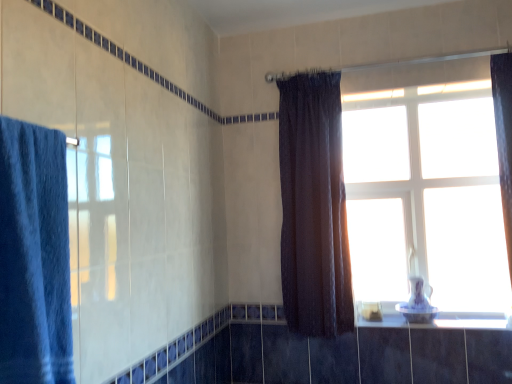
The width and height of the screenshot is (512, 384). What do you see at coordinates (313, 206) in the screenshot? I see `dark brown sheer curtain at center, the second curtain viewed from the front` at bounding box center [313, 206].

Find the location of a particular element. The height and width of the screenshot is (384, 512). dark brown sheer curtain at center, acting as the 1th curtain starting from the right is located at coordinates (313, 206).

I want to click on white glossy window sill at lower right, so click(x=441, y=320).

The height and width of the screenshot is (384, 512). I want to click on white glass window at upper right, so click(432, 191).

Can you confirm if white glossy window sill at lower right is smaller than white glass window at upper right?

Yes, white glossy window sill at lower right is smaller than white glass window at upper right.

Which of these two, white glossy window sill at lower right or white glass window at upper right, is wider?

white glossy window sill at lower right.

Is white glossy window sill at lower right with white glass window at upper right?

No, white glossy window sill at lower right is not beside white glass window at upper right.

From the image's perspective, is white glossy window sill at lower right positioned above or below white glass window at upper right?

white glossy window sill at lower right is below white glass window at upper right.

This screenshot has width=512, height=384. What are the coordinates of `curtain on the right of blue fabric towel at left, which is the 1th curtain from front to back` in the screenshot? It's located at (313, 206).

Considering the relative positions of dark brown sheer curtain at center, the second curtain viewed from the front, and blue fabric towel at left, which is the second curtain in right-to-left order, in the image provided, is dark brown sheer curtain at center, the second curtain viewed from the front, to the left of blue fabric towel at left, which is the second curtain in right-to-left order, from the viewer's perspective?

No, dark brown sheer curtain at center, the second curtain viewed from the front, is not to the left of blue fabric towel at left, which is the second curtain in right-to-left order.

Considering the sizes of objects dark brown sheer curtain at center, acting as the 1th curtain starting from the right, and blue fabric towel at left, which is the second curtain in right-to-left order, in the image provided, who is shorter, dark brown sheer curtain at center, acting as the 1th curtain starting from the right, or blue fabric towel at left, which is the second curtain in right-to-left order,?

With less height is blue fabric towel at left, which is the second curtain in right-to-left order.

Is point (391, 91) positioned in front of point (312, 231)?

No, (391, 91) is further to viewer.

Based on the photo, is white glass window at upper right oriented away from dark brown sheer curtain at center, the 2th curtain positioned from the left?

No, white glass window at upper right is not facing the opposite direction of dark brown sheer curtain at center, the 2th curtain positioned from the left.

Is white glass window at upper right bigger or smaller than dark brown sheer curtain at center, the second curtain viewed from the front?

white glass window at upper right is smaller than dark brown sheer curtain at center, the second curtain viewed from the front.

Would you say dark brown sheer curtain at center, the 2th curtain positioned from the left, is part of white glass window at upper right's contents?

Definitely not — dark brown sheer curtain at center, the 2th curtain positioned from the left, is not inside white glass window at upper right.

Can you confirm if blue fabric towel at left, which is the 1th curtain from front to back, is smaller than dark brown sheer curtain at center, the second curtain viewed from the front?

Indeed, blue fabric towel at left, which is the 1th curtain from front to back, has a smaller size compared to dark brown sheer curtain at center, the second curtain viewed from the front.

From the image's perspective, is blue fabric towel at left, which is the 1th curtain from front to back, above or below dark brown sheer curtain at center, the second curtain viewed from the front?

Clearly, from the image's perspective, blue fabric towel at left, which is the 1th curtain from front to back, is below dark brown sheer curtain at center, the second curtain viewed from the front.

From a real-world perspective, who is located lower, blue fabric towel at left, which is the 1th curtain from front to back, or dark brown sheer curtain at center, the second curtain viewed from the front?

blue fabric towel at left, which is the 1th curtain from front to back, from a real-world perspective.

Where is `window sill below the dark brown sheer curtain at center, the 2th curtain positioned from the left (from the image's perspective)`? The image size is (512, 384). window sill below the dark brown sheer curtain at center, the 2th curtain positioned from the left (from the image's perspective) is located at coordinates (441, 320).

Is dark brown sheer curtain at center, which is the 1th curtain from back to front, wider or thinner than white glossy window sill at lower right?

Clearly, dark brown sheer curtain at center, which is the 1th curtain from back to front, has less width compared to white glossy window sill at lower right.

Which is more to the right, dark brown sheer curtain at center, the 2th curtain positioned from the left, or white glossy window sill at lower right?

From the viewer's perspective, white glossy window sill at lower right appears more on the right side.

Does point (440, 313) come in front of point (314, 117)?

That is True.

From the picture: Is dark brown sheer curtain at center, the 2th curtain positioned from the left, inside white glossy window sill at lower right?

No, white glossy window sill at lower right does not contain dark brown sheer curtain at center, the 2th curtain positioned from the left.

Are white glossy window sill at lower right and dark brown sheer curtain at center, which is the 1th curtain from back to front, beside each other?

No.

Between white glossy window sill at lower right and dark brown sheer curtain at center, the second curtain viewed from the front, which one appears on the left side from the viewer's perspective?

dark brown sheer curtain at center, the second curtain viewed from the front, is more to the left.

Is white glass window at upper right inside dark brown sheer curtain at center, the second curtain viewed from the front?

No.

Considering the sizes of dark brown sheer curtain at center, the 2th curtain positioned from the left, and white glass window at upper right in the image, is dark brown sheer curtain at center, the 2th curtain positioned from the left, bigger or smaller than white glass window at upper right?

Clearly, dark brown sheer curtain at center, the 2th curtain positioned from the left, is larger in size than white glass window at upper right.

Is there a large distance between dark brown sheer curtain at center, acting as the 1th curtain starting from the right, and white glass window at upper right?

They are positioned close to each other.

The image size is (512, 384). Identify the location of window sill that is below the white glass window at upper right (from the image's perspective). (441, 320).

At what (x,y) coordinates should I click in order to perform the action: click on curtain that appears above the blue fabric towel at left, which is the second curtain in right-to-left order (from a real-world perspective). Please return your answer as a coordinate pair (x, y). This screenshot has height=384, width=512. Looking at the image, I should click on (313, 206).

Considering their positions, is white glossy window sill at lower right positioned closer to blue fabric towel at left, which is the 1th curtain from left to right, than dark brown sheer curtain at center, acting as the 1th curtain starting from the right?

dark brown sheer curtain at center, acting as the 1th curtain starting from the right, is closer to blue fabric towel at left, which is the 1th curtain from left to right.

Estimate the real-world distances between objects in this image. Which object is further from white glossy window sill at lower right, dark brown sheer curtain at center, the second curtain viewed from the front, or white glass window at upper right?

dark brown sheer curtain at center, the second curtain viewed from the front, is positioned further to the anchor white glossy window sill at lower right.

In the scene shown: Which object lies nearer to the anchor point white glossy window sill at lower right, blue fabric towel at left, which is the second curtain in right-to-left order, or dark brown sheer curtain at center, the second curtain viewed from the front?

dark brown sheer curtain at center, the second curtain viewed from the front, is closer to white glossy window sill at lower right.

When comparing their distances from white glossy window sill at lower right, does white glass window at upper right or dark brown sheer curtain at center, acting as the 1th curtain starting from the right, seem further?

dark brown sheer curtain at center, acting as the 1th curtain starting from the right, is positioned further to the anchor white glossy window sill at lower right.

When comparing their distances from white glass window at upper right, does dark brown sheer curtain at center, the 2th curtain positioned from the left, or white glossy window sill at lower right seem further?

Based on the image, white glossy window sill at lower right appears to be further to white glass window at upper right.

From the image, which object appears to be nearer to blue fabric towel at left, which is the 1th curtain from left to right, white glass window at upper right or white glossy window sill at lower right?

white glossy window sill at lower right is closer to blue fabric towel at left, which is the 1th curtain from left to right.

When comparing their distances from blue fabric towel at left, the 2th curtain in the back-to-front sequence, does white glossy window sill at lower right or white glass window at upper right seem further?

white glass window at upper right lies further to blue fabric towel at left, the 2th curtain in the back-to-front sequence, than the other object.

From the picture: Estimate the real-world distances between objects in this image. Which object is further from white glass window at upper right, blue fabric towel at left, the 2th curtain in the back-to-front sequence, or dark brown sheer curtain at center, which is the 1th curtain from back to front?

blue fabric towel at left, the 2th curtain in the back-to-front sequence, is positioned further to the anchor white glass window at upper right.

I want to click on window sill located between dark brown sheer curtain at center, the 2th curtain positioned from the left, and white glass window at upper right in the left-right direction, so click(441, 320).

Identify the location of window sill located between blue fabric towel at left, the 2th curtain in the back-to-front sequence, and white glass window at upper right in the depth direction. Image resolution: width=512 pixels, height=384 pixels. click(x=441, y=320).

The image size is (512, 384). What are the coordinates of `window sill between blue fabric towel at left, which is the second curtain in right-to-left order, and dark brown sheer curtain at center, the 2th curtain positioned from the left, in the front-back direction` in the screenshot? It's located at (441, 320).

Image resolution: width=512 pixels, height=384 pixels. Identify the location of curtain located between blue fabric towel at left, which is the 1th curtain from front to back, and white glass window at upper right in the depth direction. [x=313, y=206].